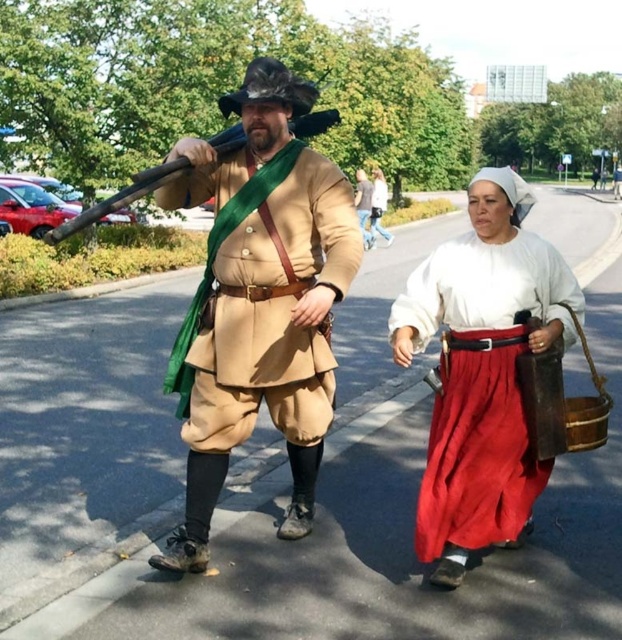
You are a costume designer examining the historical costumes in the image. You need to determine the spatial relationship between the matte brown leather outfit at center and the matte brown leather purse at center. Which object is closer to the viewer?

The matte brown leather outfit at center is in front of the matte brown leather purse at center, so the matte brown leather outfit at center is closer to the viewer.

What is located at the point with coordinates (483, 371) in the image?

The point with coordinates (483, 371) is located on the matte white blouse at center.

You are a photographer trying to capture a closeup shot of the two points in the image. Which point, point (x=422, y=310) or point (x=356, y=173), is closer to your camera lens?

Point (x=422, y=310) is closer to the camera lens than point (x=356, y=173).